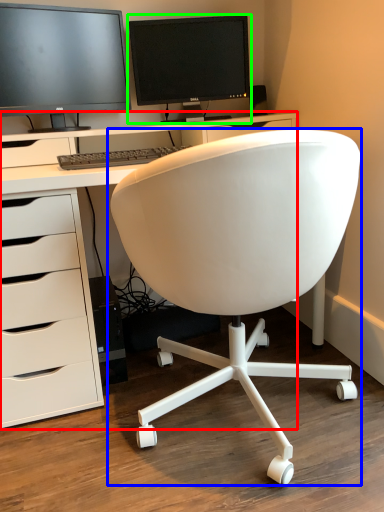
Question: Which object is positioned closest to desk (highlighted by a red box)? Select from chair (highlighted by a blue box) and computer monitor (highlighted by a green box).

Choices:
 (A) chair
 (B) computer monitor

Answer: (A)